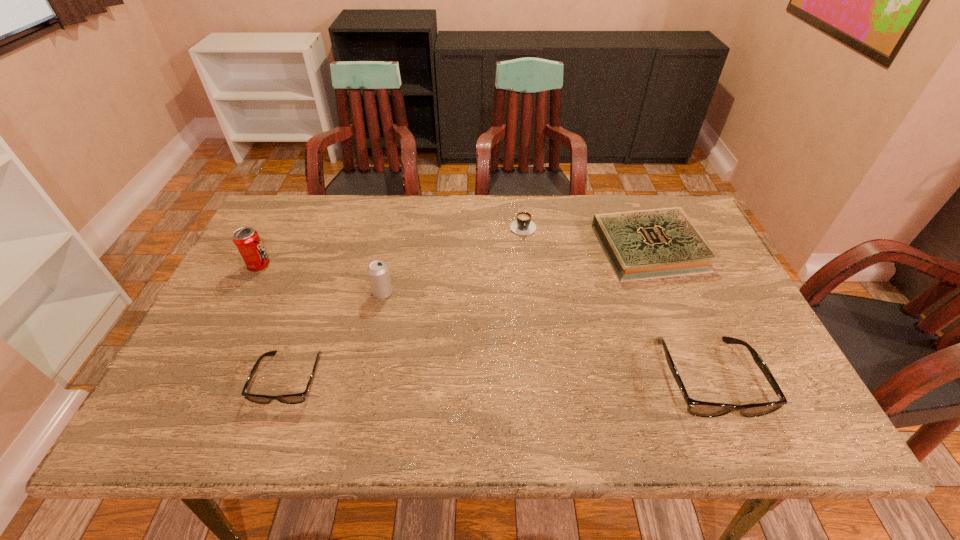
The height and width of the screenshot is (540, 960). In order to click on object that is at the near right corner in this screenshot , I will do `click(697, 408)`.

What are the coordinates of `vacant space at the far edge of the desktop` in the screenshot? It's located at (543, 221).

Image resolution: width=960 pixels, height=540 pixels. Identify the location of vacant space at the near edge of the desktop. (462, 377).

The height and width of the screenshot is (540, 960). In the image, there is a desktop. Find the location of `vacant space at the left edge`. vacant space at the left edge is located at coordinates (212, 342).

At what (x,y) coordinates should I click in order to perform the action: click on blank space at the right edge of the desktop. Please return your answer as a coordinate pair (x, y). Looking at the image, I should click on (768, 361).

Locate an element on the screen. This screenshot has height=540, width=960. blank area at the far right corner is located at coordinates (648, 208).

This screenshot has height=540, width=960. Identify the location of free space between the fourth farthest object and the hardback book. (516, 271).

This screenshot has width=960, height=540. I want to click on free space between the third tallest object and the shorter spectacles, so click(x=498, y=379).

Locate an element on the screen. vacant area between the soda can and the fourth object from left to right is located at coordinates (391, 245).

Identify the location of free space between the soda can and the third object from right to left. (391, 245).